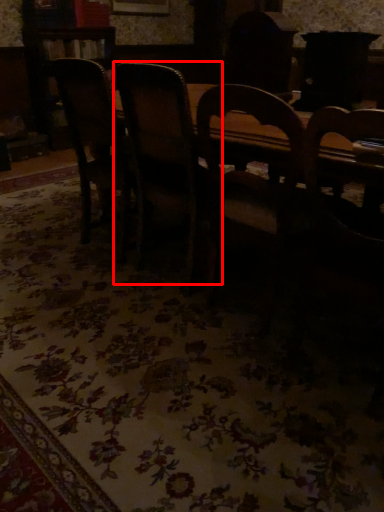
Question: From the image's perspective, where is chair (annotated by the red box) located in relation to chair in the image?

Choices:
 (A) above
 (B) below

Answer: (B)